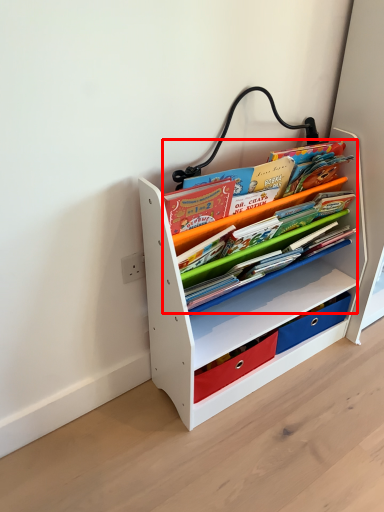
Question: From the image's perspective, what is the correct spatial relationship of book (annotated by the red box) in relation to shelf?

Choices:
 (A) above
 (B) below

Answer: (A)